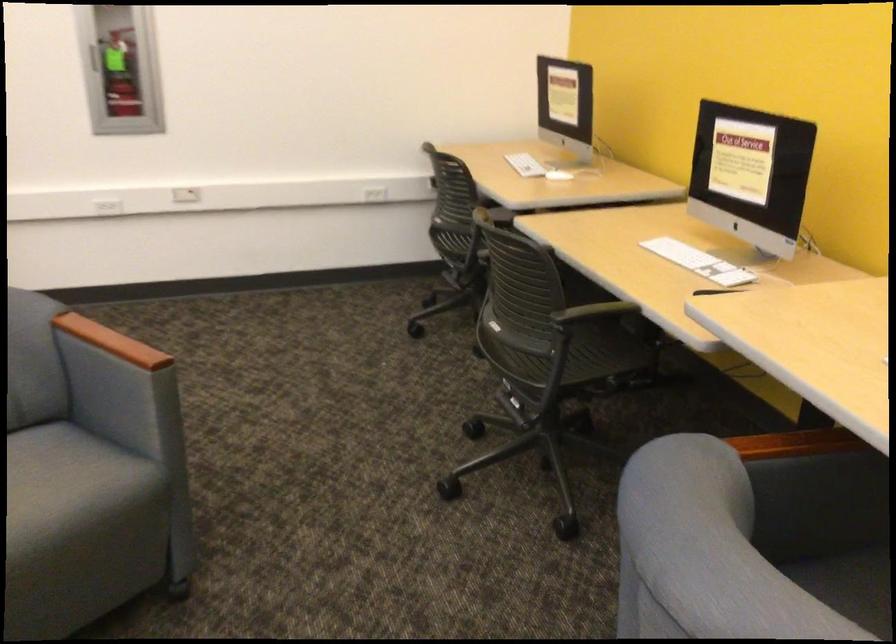
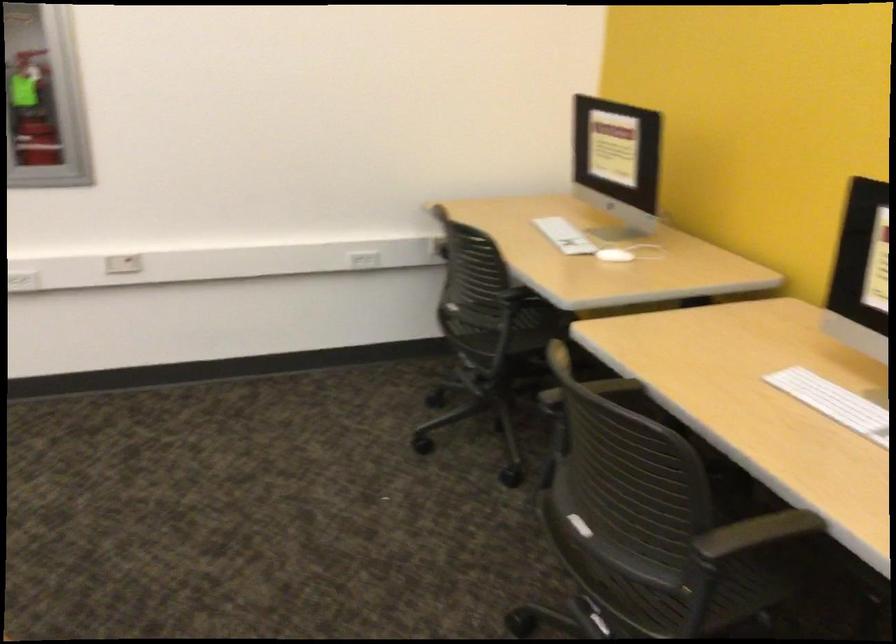
Question: Which direction would the cameraman need to move to produce the second image? Reply with the corresponding letter.

Choices:
 (A) Left
 (B) Right
 (C) Forward
 (D) Backward

Answer: (C)